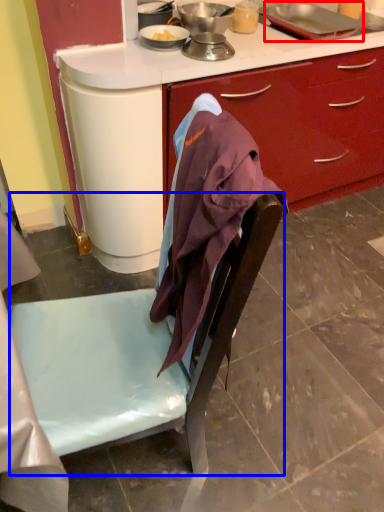
Question: Which object is further to the camera taking this photo, kitchen appliance (highlighted by a red box) or chair (highlighted by a blue box)?

Choices:
 (A) kitchen appliance
 (B) chair

Answer: (A)